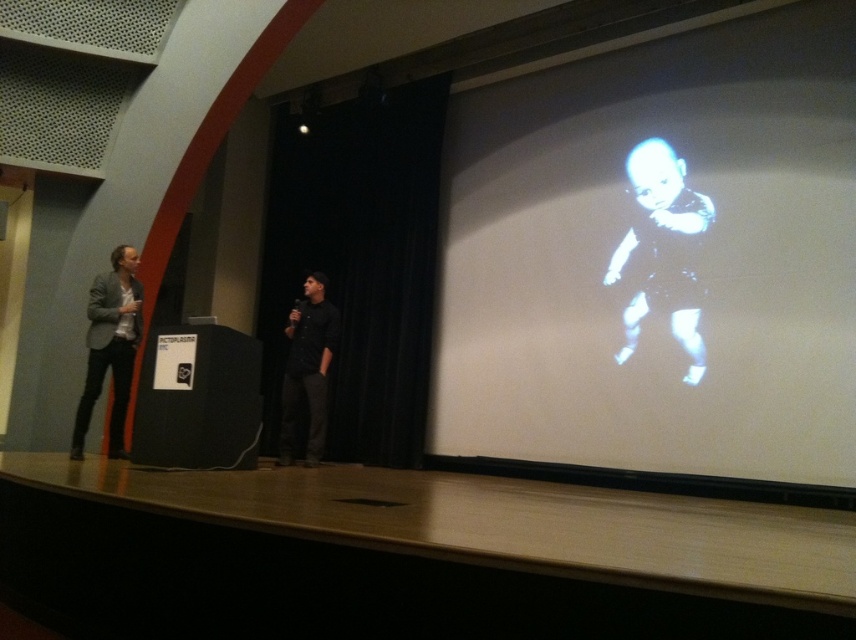
Between point (611, 120) and point (324, 284), which one is positioned in front?

Positioned in front is point (324, 284).

Is white matte projection screen at upper right above black matte shirt at center?

Indeed, white matte projection screen at upper right is positioned over black matte shirt at center.

Describe the element at coordinates (658, 259) in the screenshot. I see `white matte projection screen at upper right` at that location.

I want to click on white matte projection screen at upper right, so click(658, 259).

In the scene shown: Is black matte baby at upper right behind black matte shirt at center?

No, black matte baby at upper right is closer to the viewer.

Image resolution: width=856 pixels, height=640 pixels. Find the location of `black matte baby at upper right`. black matte baby at upper right is located at coordinates pyautogui.click(x=666, y=193).

Is dark gray suit at left in front of black matte shirt at center?

Yes.

Is dark gray suit at left shorter than black matte shirt at center?

No.

Who is more forward, [111,349] or [311,413]?

Positioned in front is point [111,349].

Identify the location of dark gray suit at left. (110, 346).